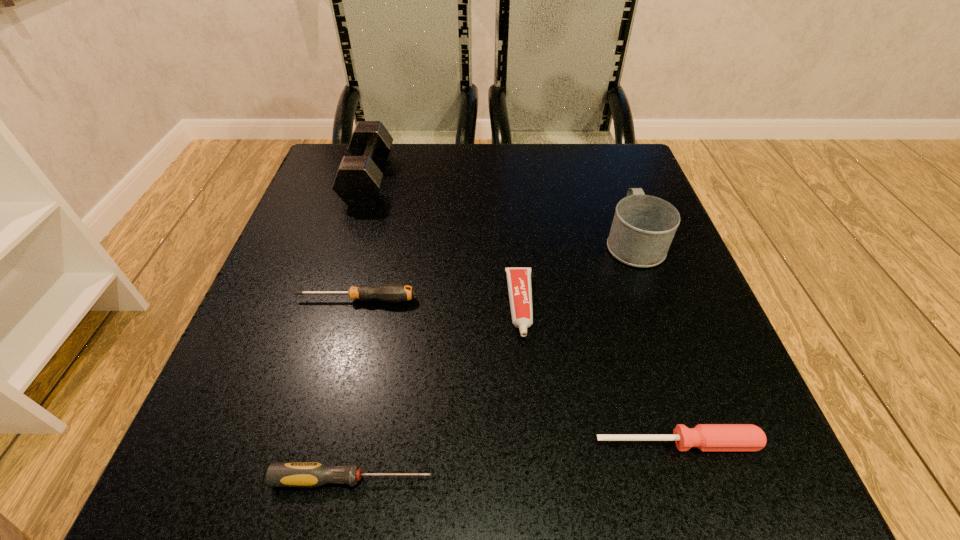
Where is `free spot between the third object from right to left and the rightmost screwdriver`? The width and height of the screenshot is (960, 540). free spot between the third object from right to left and the rightmost screwdriver is located at coordinates (599, 374).

At what (x,y) coordinates should I click in order to perform the action: click on unoccupied area between the nearest screwdriver and the fifth nearest object. Please return your answer as a coordinate pair (x, y). Image resolution: width=960 pixels, height=540 pixels. Looking at the image, I should click on (493, 360).

Identify the location of vacant point located between the rightmost screwdriver and the second farthest object. Image resolution: width=960 pixels, height=540 pixels. (656, 342).

Identify the location of free space between the fifth nearest object and the farthest object. This screenshot has width=960, height=540. (501, 211).

Where is `vacant area between the third object from right to left and the mug`? Image resolution: width=960 pixels, height=540 pixels. vacant area between the third object from right to left and the mug is located at coordinates (577, 273).

Identify the location of free spot between the third object from right to left and the mug. (577, 273).

At what (x,y) coordinates should I click in order to perform the action: click on object identified as the closest to the nearest screwdriver. Please return your answer as a coordinate pair (x, y). Looking at the image, I should click on (707, 437).

Choose which object is the third nearest neighbor to the mug. Please provide its 2D coordinates. Your answer should be formatted as a tuple, i.e. [(x, y)], where the tuple contains the x and y coordinates of a point satisfying the conditions above.

[(393, 292)]

The height and width of the screenshot is (540, 960). I want to click on the closest screwdriver relative to the second farthest object, so click(707, 437).

Locate an element on the screen. The height and width of the screenshot is (540, 960). screwdriver that can be found as the third closest to the dumbbell is located at coordinates (707, 437).